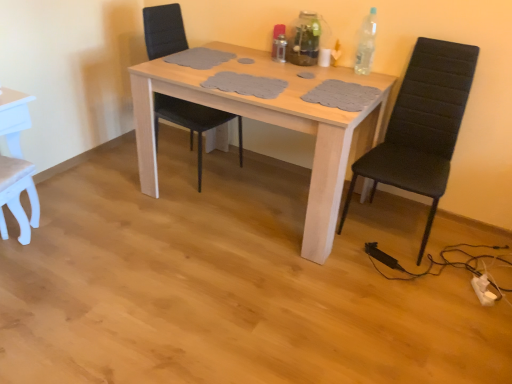
Locate an element on the screen. The image size is (512, 384). free area below black fabric chair at right, marked as the 3th chair in a left-to-right arrangement (from a real-world perspective) is located at coordinates (391, 229).